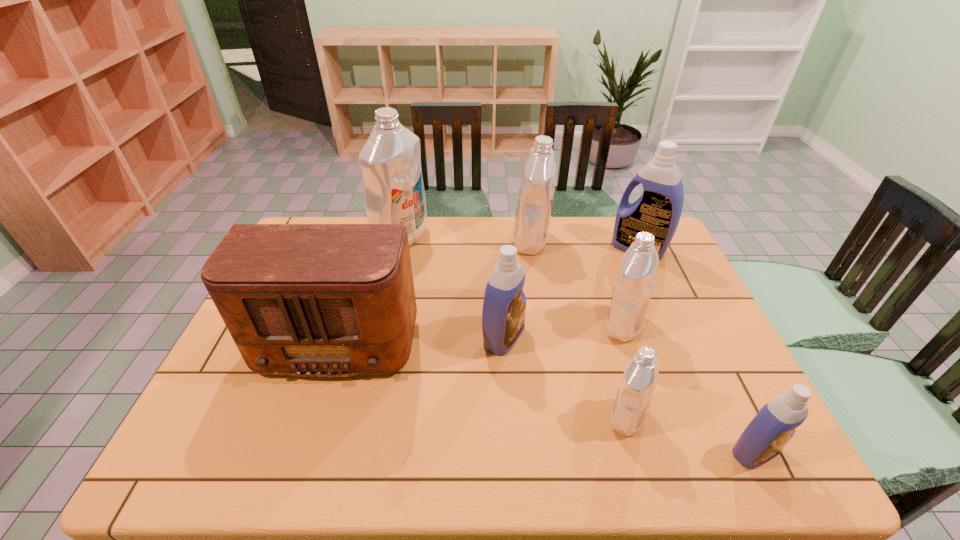
Identify the location of free space located 0.350m on the right of the leftmost detergent. The height and width of the screenshot is (540, 960). (527, 238).

Where is `free spot located on the left of the second biggest white detergent`? free spot located on the left of the second biggest white detergent is located at coordinates (471, 241).

Find the location of a particular element. The image size is (960, 540). free space located on the front of the biggest blue detergent is located at coordinates (681, 343).

This screenshot has width=960, height=540. What are the coordinates of `free space located 0.190m on the front panel of the radio receiver` in the screenshot? It's located at (300, 463).

Where is `vacant space located on the left of the second smallest white detergent`? The width and height of the screenshot is (960, 540). vacant space located on the left of the second smallest white detergent is located at coordinates (534, 326).

Locate an element on the screen. vacant position located on the back of the leftmost blue detergent is located at coordinates (501, 280).

The height and width of the screenshot is (540, 960). I want to click on vacant space situated on the left of the smallest white detergent, so click(468, 417).

Locate an element on the screen. free region located on the left of the smallest blue detergent is located at coordinates (608, 452).

In order to click on object that is at the left edge in this screenshot , I will do 311,300.

Where is `object located in the far right corner section of the desktop`? The height and width of the screenshot is (540, 960). object located in the far right corner section of the desktop is located at coordinates (658, 211).